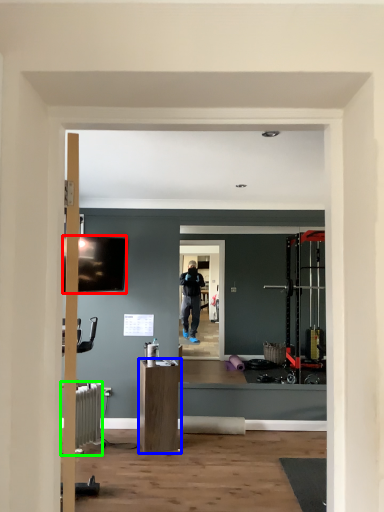
Question: Which is nearer to the television (highlighted by a red box)? furniture (highlighted by a blue box) or radiator (highlighted by a green box).

Choices:
 (A) furniture
 (B) radiator

Answer: (B)